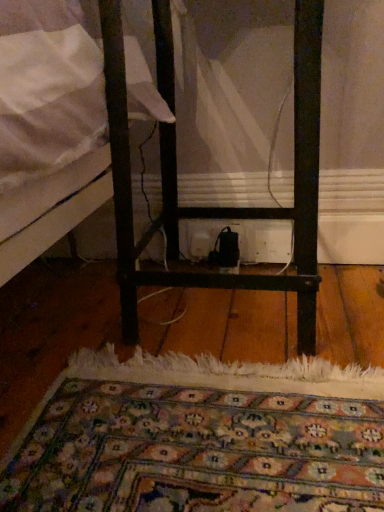
Find the location of a particular element. free point below black metal nightstand at center (from a real-world perspective) is located at coordinates (x=225, y=311).